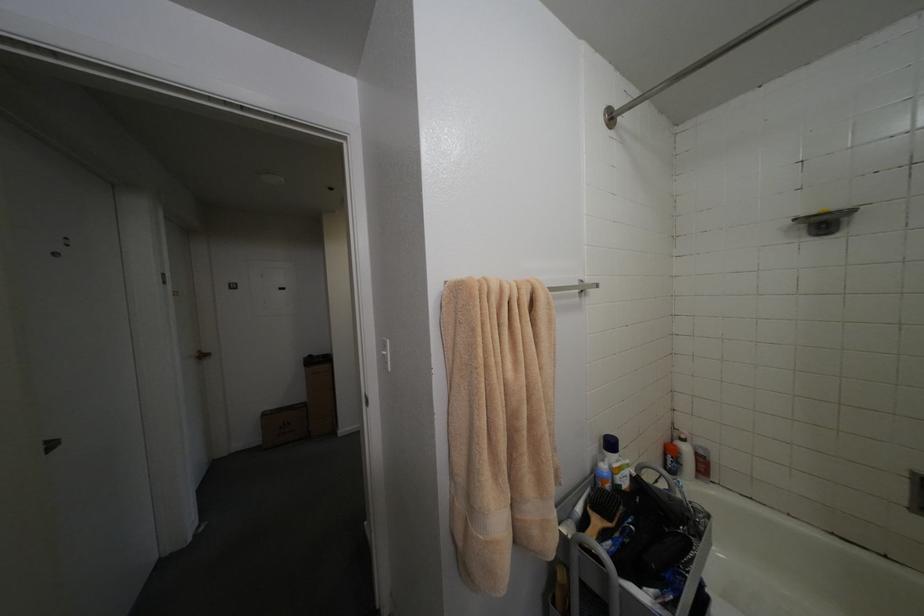
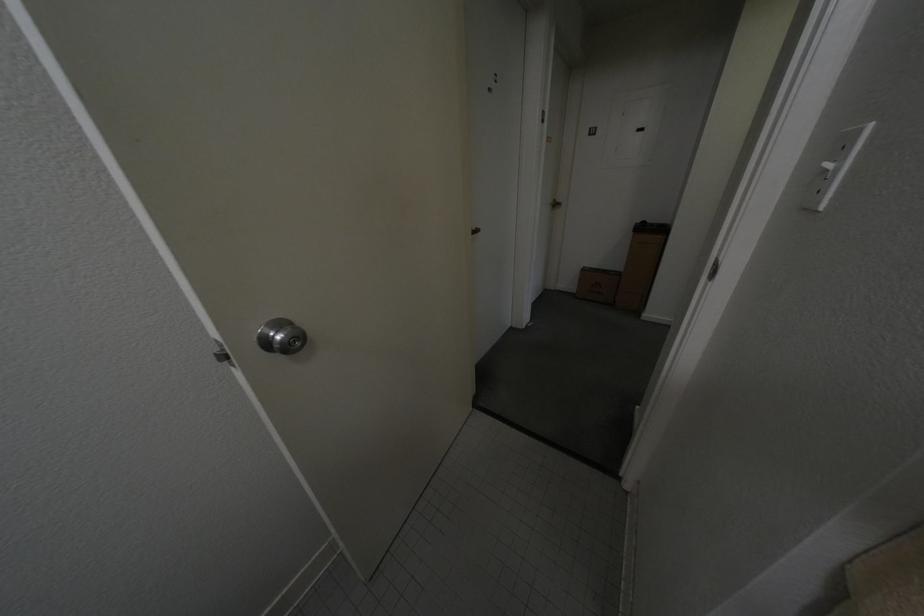
How did the camera likely rotate?

The rotation direction of the camera is left-down.